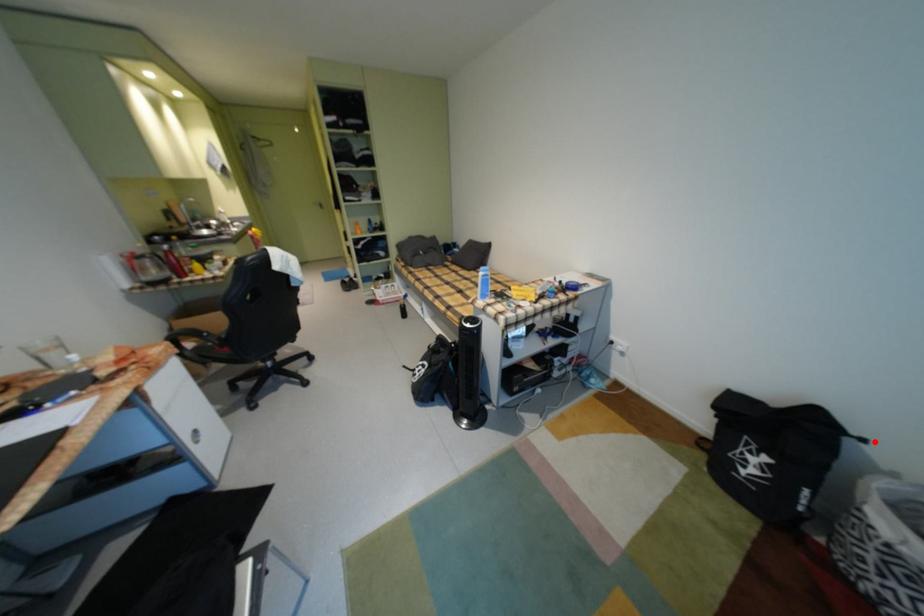
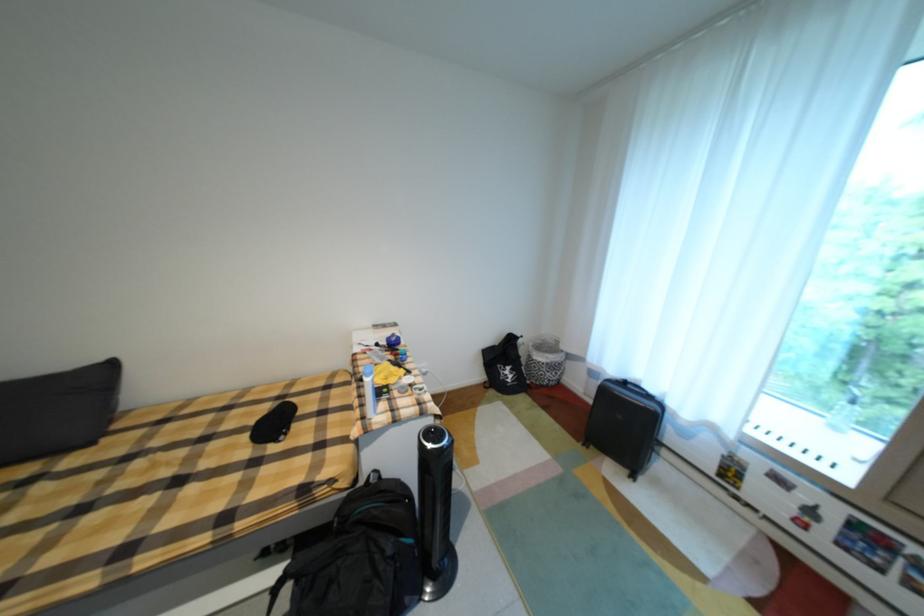
In the second image, find the point that corresponds to the highlighted location in the first image.

(531, 338)